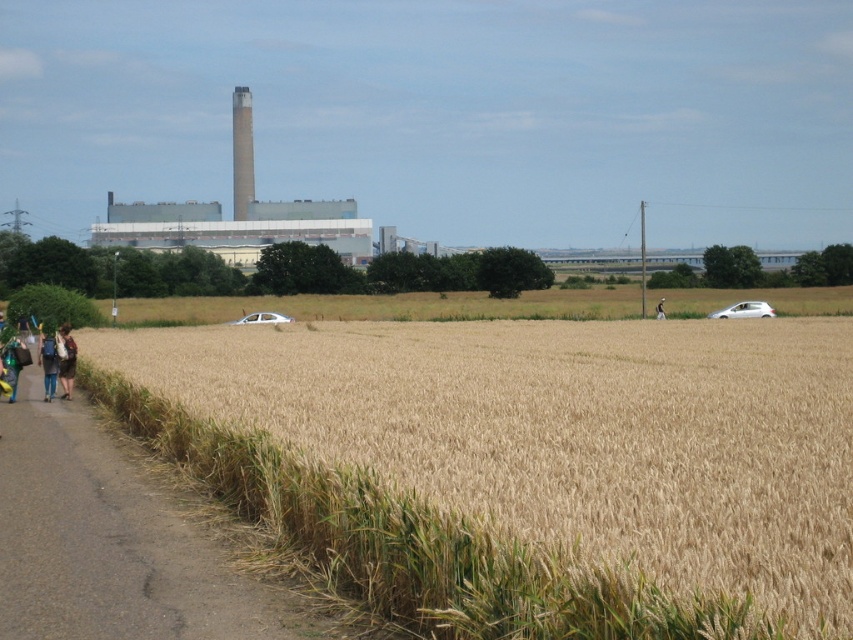
Based on the photo, does golden wheat field at left appear over asphalt road at lower left?

Indeed, golden wheat field at left is positioned over asphalt road at lower left.

Is golden wheat field at left shorter than asphalt road at lower left?

Incorrect, golden wheat field at left's height does not fall short of asphalt road at lower left's.

The height and width of the screenshot is (640, 853). Describe the element at coordinates (526, 465) in the screenshot. I see `golden wheat field at left` at that location.

Find the location of a particular element. golden wheat field at left is located at coordinates (526, 465).